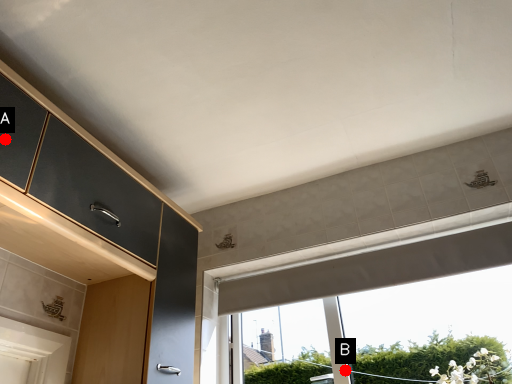
Question: Two points are circled on the image, labeled by A and B beside each circle. Which point is further to the camera?

Choices:
 (A) A is further
 (B) B is further

Answer: (B)